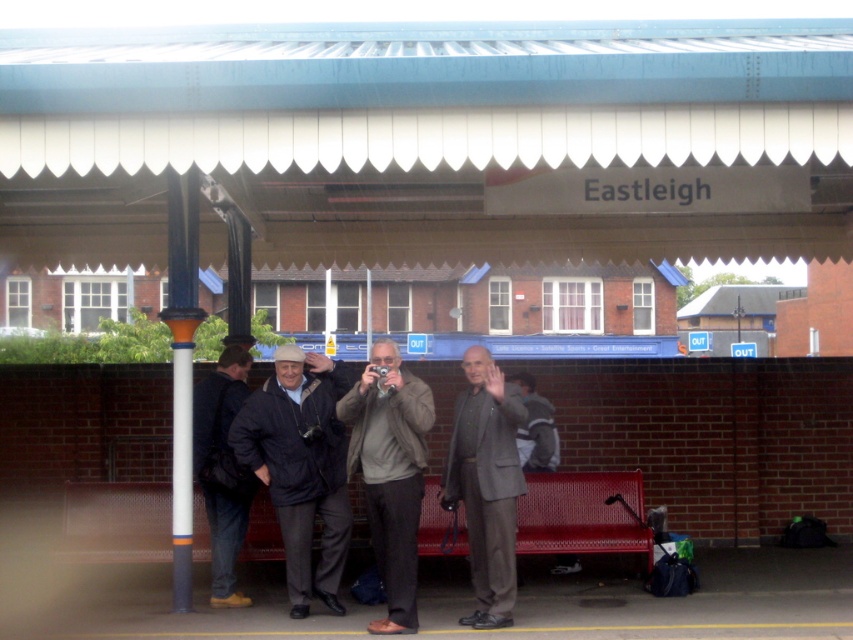
You are standing on the Eastleigh station platform and see the matte black jacket at center and the dark blue jeans at left. Which clothing item is positioned to the right of the other?

The matte black jacket at center is to the right of the dark blue jeans at left.

You are standing on the Eastleigh station platform and notice two jackets at the center. Which jacket is closer to you, the matte black jacket at center or the gray woolen jacket at center?

The matte black jacket at center is closer to you because the gray woolen jacket at center is positioned behind it.

You are a photographer at Eastleigh station. You notice two items in your frame, the matte black jacket at center and the dark blue jeans at left. Which item appears taller in the photo?

The matte black jacket at center appears taller than the dark blue jeans at left in the photo.